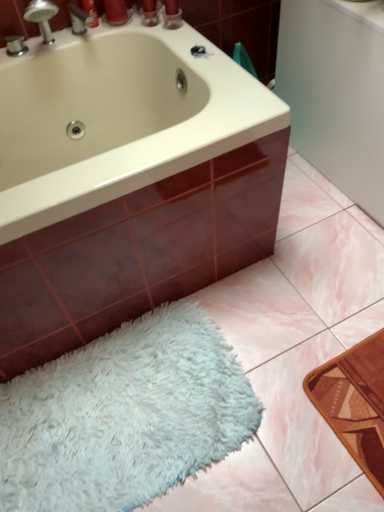
Question: Considering the relative sizes of brushed metal faucet at upper left and white fluffy bath mat at lower left in the image provided, is brushed metal faucet at upper left taller than white fluffy bath mat at lower left?

Choices:
 (A) no
 (B) yes

Answer: (B)

Question: From the image's perspective, is brushed metal faucet at upper left over white fluffy bath mat at lower left?

Choices:
 (A) yes
 (B) no

Answer: (A)

Question: Does brushed metal faucet at upper left touch white fluffy bath mat at lower left?

Choices:
 (A) yes
 (B) no

Answer: (B)

Question: Is the depth of brushed metal faucet at upper left greater than that of white fluffy bath mat at lower left?

Choices:
 (A) yes
 (B) no

Answer: (A)

Question: Considering the relative positions of brushed metal faucet at upper left and white fluffy bath mat at lower left in the image provided, is brushed metal faucet at upper left to the right of white fluffy bath mat at lower left from the viewer's perspective?

Choices:
 (A) no
 (B) yes

Answer: (A)

Question: Is point (66, 75) closer or farther from the camera than point (87, 410)?

Choices:
 (A) farther
 (B) closer

Answer: (A)

Question: Is white glossy bathtub at upper left to the left or to the right of white fluffy bath mat at lower left in the image?

Choices:
 (A) right
 (B) left

Answer: (B)

Question: From a real-world perspective, relative to white fluffy bath mat at lower left, is white glossy bathtub at upper left vertically above or below?

Choices:
 (A) above
 (B) below

Answer: (A)

Question: In terms of width, does white glossy bathtub at upper left look wider or thinner when compared to white fluffy bath mat at lower left?

Choices:
 (A) wide
 (B) thin

Answer: (A)

Question: Considering the positions of point (33, 68) and point (74, 15), is point (33, 68) closer or farther from the camera than point (74, 15)?

Choices:
 (A) farther
 (B) closer

Answer: (B)

Question: From the image's perspective, is white glossy bathtub at upper left positioned above or below brushed metal faucet at upper left?

Choices:
 (A) above
 (B) below

Answer: (B)

Question: In terms of height, does white glossy bathtub at upper left look taller or shorter compared to brushed metal faucet at upper left?

Choices:
 (A) short
 (B) tall

Answer: (B)

Question: Based on their sizes in the image, would you say white glossy bathtub at upper left is bigger or smaller than brushed metal faucet at upper left?

Choices:
 (A) small
 (B) big

Answer: (B)

Question: Is white fluffy bath mat at lower left situated inside white glossy bathtub at upper left or outside?

Choices:
 (A) inside
 (B) outside

Answer: (B)

Question: Considering the positions of point (162, 417) and point (278, 97), is point (162, 417) closer or farther from the camera than point (278, 97)?

Choices:
 (A) closer
 (B) farther

Answer: (A)